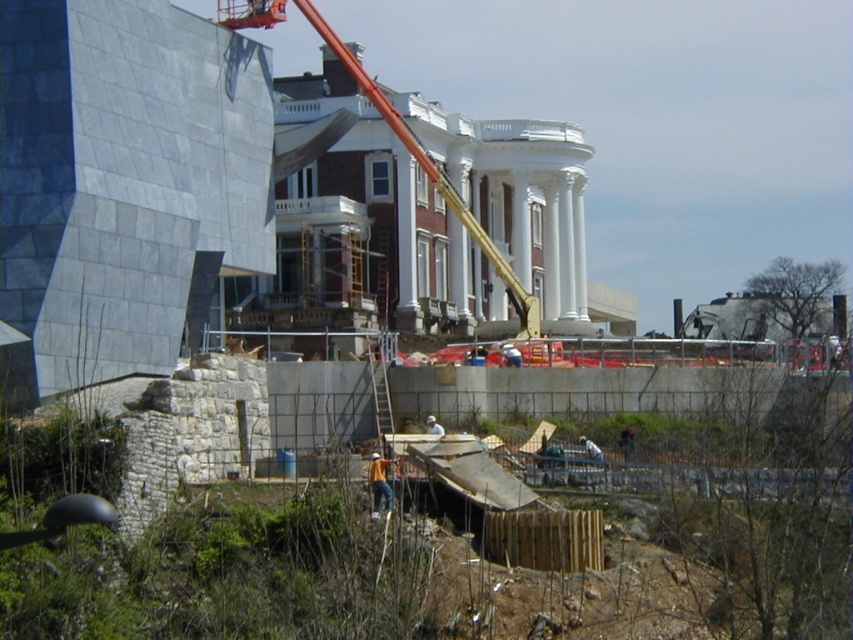
Which is above, orange safety vest at center or white matte hard hat at center?

white matte hard hat at center is above.

Is point (380, 476) closer to camera compared to point (433, 428)?

Yes.

Identify the location of orange safety vest at center. (379, 484).

Between point (524, 321) and point (374, 490), which one is positioned in front?

Positioned in front is point (374, 490).

Is orange metallic crane at center above orange safety vest at center?

Yes, orange metallic crane at center is above orange safety vest at center.

Is point (253, 16) positioned before point (379, 497)?

No, it is not.

Where is `orange metallic crane at center`? orange metallic crane at center is located at coordinates (431, 173).

Locate an element on the screen. The height and width of the screenshot is (640, 853). orange metallic crane at center is located at coordinates coord(431,173).

Can you confirm if orange metallic crane at center is smaller than white matte hard hat at center?

No.

Identify the location of orange metallic crane at center. The width and height of the screenshot is (853, 640). (431, 173).